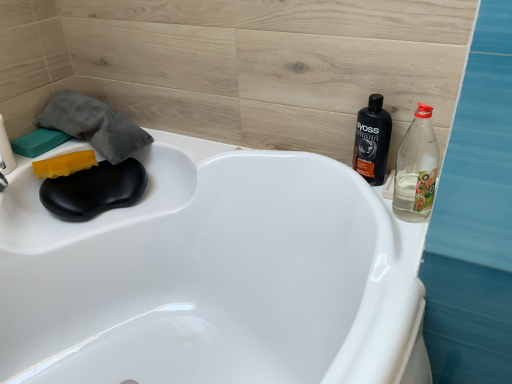
Question: Is clear plastic bottle at right, which is counted as the first bottle, starting from the front, to the right of yellow sponge at left, acting as the first soap starting from the right, from the viewer's perspective?

Choices:
 (A) yes
 (B) no

Answer: (A)

Question: From the image's perspective, would you say clear plastic bottle at right, which is counted as the first bottle, starting from the front, is shown under yellow sponge at left, acting as the 2th soap starting from the left?

Choices:
 (A) yes
 (B) no

Answer: (A)

Question: Does clear plastic bottle at right, the 2th bottle when ordered from back to front, come behind yellow sponge at left, acting as the first soap starting from the right?

Choices:
 (A) no
 (B) yes

Answer: (A)

Question: From the image's perspective, is clear plastic bottle at right, the 2th bottle when ordered from back to front, located above yellow sponge at left, acting as the 2th soap starting from the left?

Choices:
 (A) no
 (B) yes

Answer: (A)

Question: Is clear plastic bottle at right, which is counted as the first bottle, starting from the front, bigger than yellow sponge at left, acting as the 2th soap starting from the left?

Choices:
 (A) no
 (B) yes

Answer: (B)

Question: Considering the relative sizes of clear plastic bottle at right, the 2th bottle when ordered from back to front, and yellow sponge at left, acting as the first soap starting from the right, in the image provided, is clear plastic bottle at right, the 2th bottle when ordered from back to front, thinner than yellow sponge at left, acting as the first soap starting from the right,?

Choices:
 (A) yes
 (B) no

Answer: (A)

Question: Is clear plastic bottle at right, the 2th bottle when ordered from back to front, taller than green sponge at upper left, the 2th soap viewed from the right?

Choices:
 (A) yes
 (B) no

Answer: (A)

Question: Is clear plastic bottle at right, which is counted as the first bottle, starting from the front, with green sponge at upper left, the first soap positioned from the left?

Choices:
 (A) no
 (B) yes

Answer: (A)

Question: From a real-world perspective, is clear plastic bottle at right, the 2th bottle when ordered from back to front, physically below green sponge at upper left, the 2th soap viewed from the right?

Choices:
 (A) no
 (B) yes

Answer: (A)

Question: From the image's perspective, is clear plastic bottle at right, which is counted as the first bottle, starting from the front, under green sponge at upper left, the first soap positioned from the left?

Choices:
 (A) no
 (B) yes

Answer: (B)

Question: Can you confirm if clear plastic bottle at right, which is counted as the first bottle, starting from the front, is shorter than green sponge at upper left, the first soap positioned from the left?

Choices:
 (A) yes
 (B) no

Answer: (B)

Question: Is clear plastic bottle at right, the 2th bottle when ordered from back to front, thinner than green sponge at upper left, the first soap positioned from the left?

Choices:
 (A) yes
 (B) no

Answer: (A)

Question: Is yellow sponge at left, acting as the 2th soap starting from the left, facing away from green sponge at upper left, the first soap positioned from the left?

Choices:
 (A) yes
 (B) no

Answer: (A)